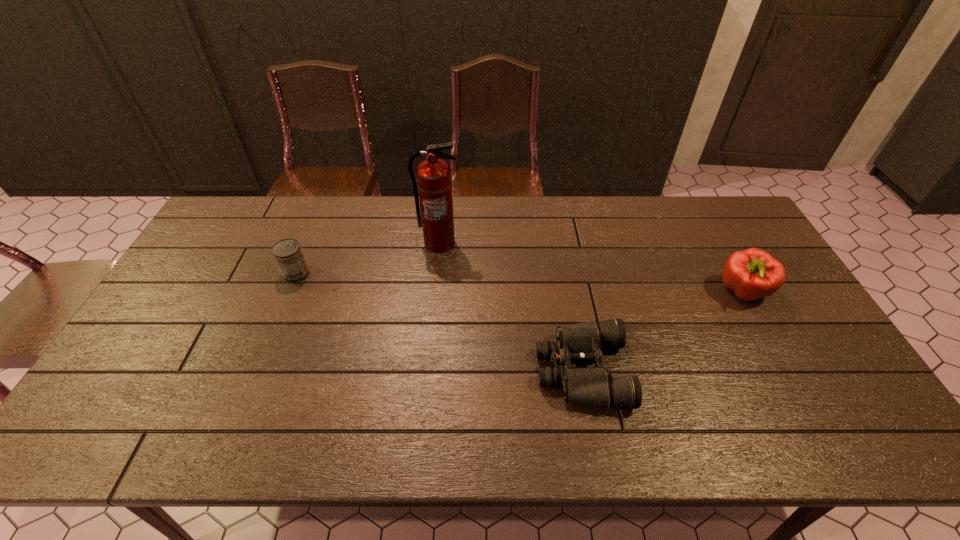
Find the location of a particular element. This screenshot has height=540, width=960. vacant region between the can and the rightmost object is located at coordinates (519, 282).

Image resolution: width=960 pixels, height=540 pixels. Find the location of `the closest object to the fire extinguisher`. the closest object to the fire extinguisher is located at coordinates (288, 254).

Select which object is the third closest to the second tallest object. Please provide its 2D coordinates. Your answer should be formatted as a tuple, i.e. [(x, y)], where the tuple contains the x and y coordinates of a point satisfying the conditions above.

[(288, 254)]

The width and height of the screenshot is (960, 540). Identify the location of blank space that satisfies the following two spatial constraints: 1. on the front side of the rightmost object; 2. through the eyepieces of the nearest object. coord(786,370).

Image resolution: width=960 pixels, height=540 pixels. I want to click on vacant area in the image that satisfies the following two spatial constraints: 1. on the front side of the third shortest object; 2. through the eyepieces of the nearest object, so click(x=786, y=370).

Where is `free spot that satisfies the following two spatial constraints: 1. on the nozzle side of the second tallest object; 2. on the right side of the second object from left to right`? This screenshot has width=960, height=540. free spot that satisfies the following two spatial constraints: 1. on the nozzle side of the second tallest object; 2. on the right side of the second object from left to right is located at coordinates (434, 292).

The height and width of the screenshot is (540, 960). I want to click on free space in the image that satisfies the following two spatial constraints: 1. on the nozzle side of the fire extinguisher; 2. on the left side of the rightmost object, so point(434,292).